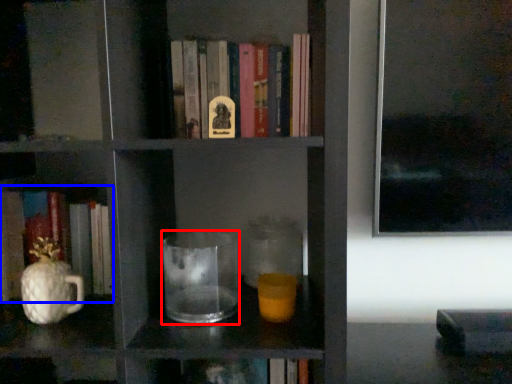
Question: Which point is closer to the camera, jug (highlighted by a red box) or book (highlighted by a blue box)?

Choices:
 (A) jug
 (B) book

Answer: (A)